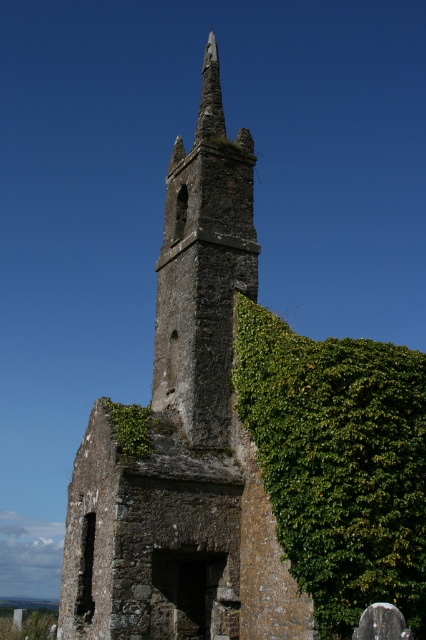
Who is higher up, rusty stone church steeple at center or rusty stone tower at center?

Positioned higher is rusty stone church steeple at center.

Does rusty stone church steeple at center appear on the right side of rusty stone tower at center?

Correct, you'll find rusty stone church steeple at center to the right of rusty stone tower at center.

Who is more distant from viewer, (279, 602) or (204, 397)?

Positioned behind is point (204, 397).

At what (x,y) coordinates should I click in order to perform the action: click on rusty stone church steeple at center. Please return your answer as a coordinate pair (x, y). Looking at the image, I should click on (184, 438).